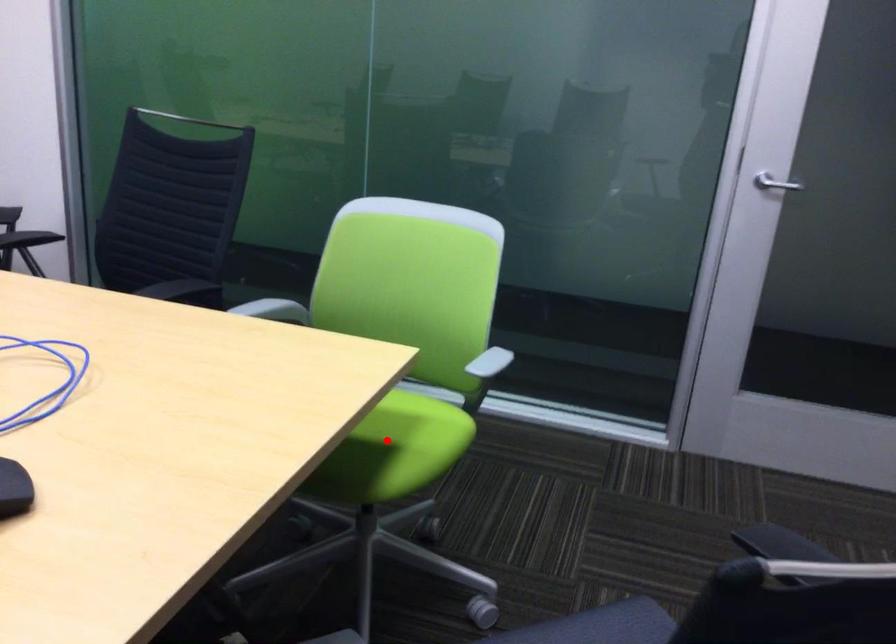
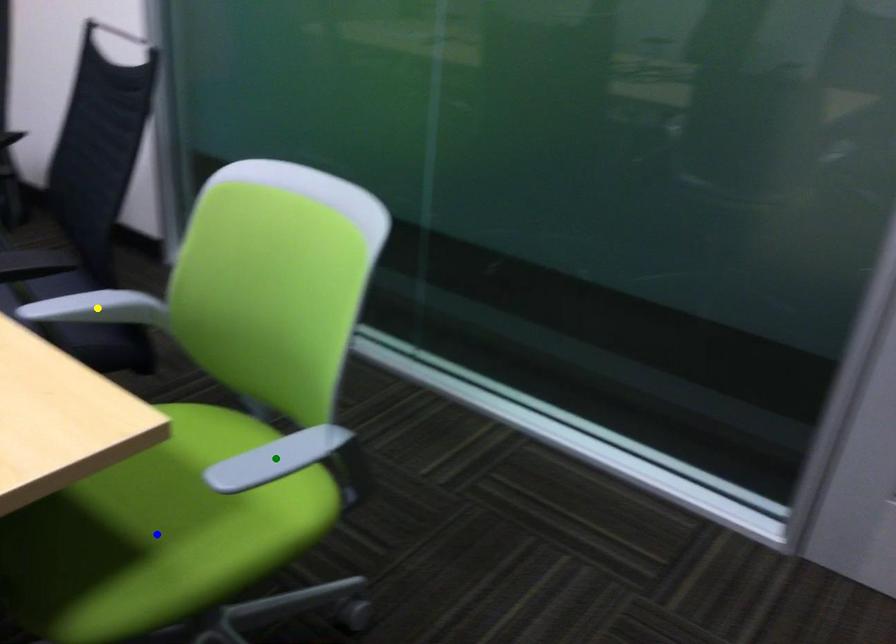
Question: I am providing you with two images of the same scene from different viewpoints. A red point is marked on the first image. You are given multiple points on the second image. In image 2, which mark is for the same physical point as the one in image 1?

Choices:
 (A) blue point
 (B) green point
 (C) yellow point

Answer: (A)